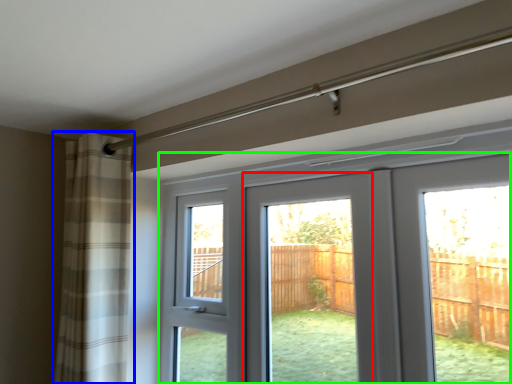
Question: Based on their relative distances, which object is nearer to screen door (highlighted by a red box)? Choose from curtain (highlighted by a blue box) and door (highlighted by a green box).

Choices:
 (A) curtain
 (B) door

Answer: (A)